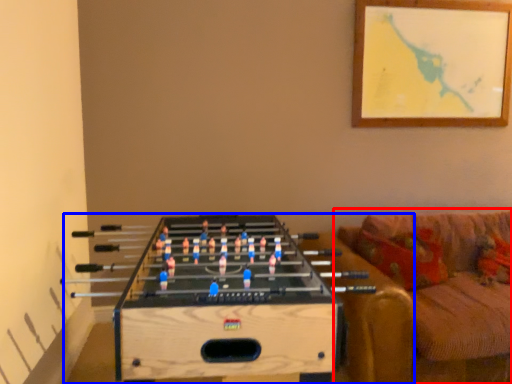
Question: Which point is closer to the camera, studio couch (highlighted by a red box) or table (highlighted by a blue box)?

Choices:
 (A) studio couch
 (B) table

Answer: (B)